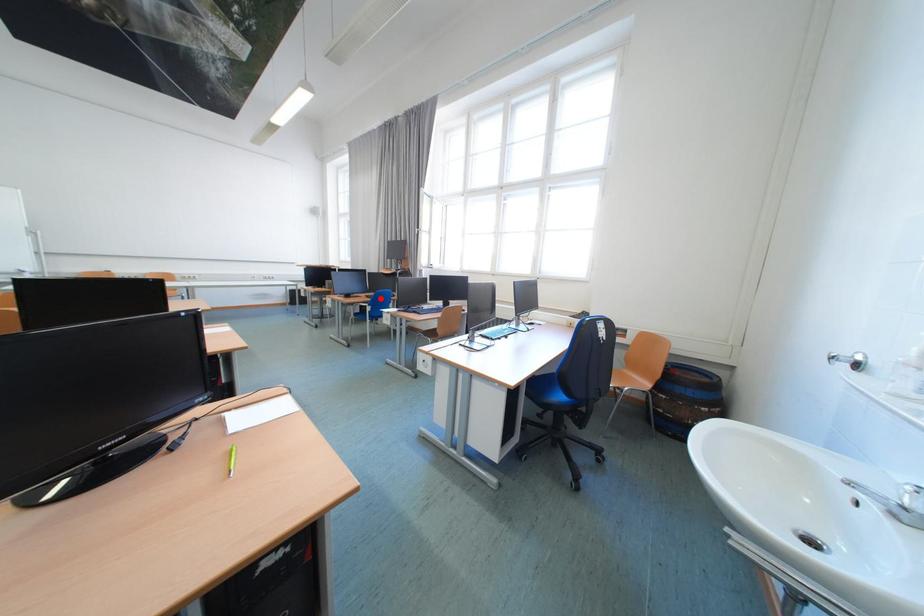
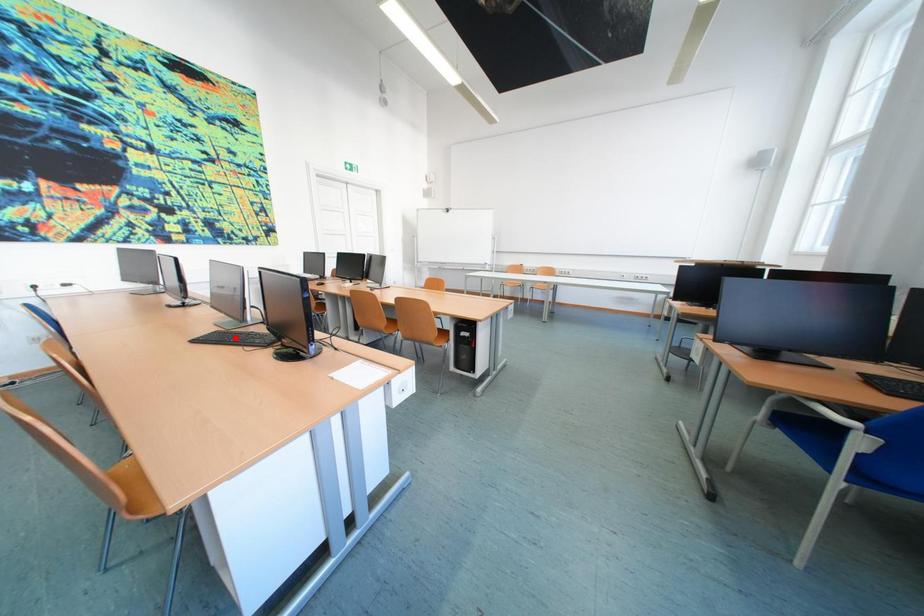
I am providing you with two images of the same scene from different viewpoints. A red point is marked on the first image and another point is marked on the second image. Does the point marked in image1 correspond to the same location as the one in image2?

No